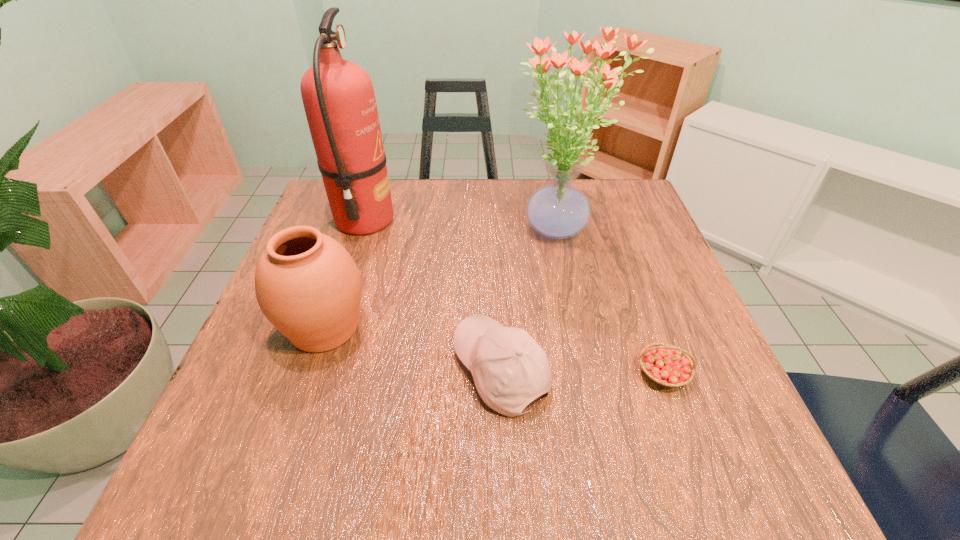
Where is `fire extinguisher`? fire extinguisher is located at coordinates (339, 101).

Locate an element on the screen. This screenshot has width=960, height=540. flower arrangement is located at coordinates (558, 210).

Where is `urn`? The width and height of the screenshot is (960, 540). urn is located at coordinates (307, 285).

The image size is (960, 540). What are the coordinates of `baseball cap` in the screenshot? It's located at (509, 368).

At what (x,y) coordinates should I click in order to perform the action: click on strawberry. Please return your answer as a coordinate pair (x, y). Looking at the image, I should click on (666, 365).

You are a GUI agent. You are given a task and a screenshot of the screen. Output one action in this format:
    pyautogui.click(x=<x>, y=<y>)
    Task: Click on the vacant space located 0.090m on the side of the fire extinguisher with the nozzle and handle
    The height and width of the screenshot is (540, 960).
    Given the screenshot: What is the action you would take?
    pyautogui.click(x=430, y=220)

The width and height of the screenshot is (960, 540). In order to click on vacant space located 0.370m on the left of the flower arrangement in this screenshot , I will do `click(354, 232)`.

In order to click on vacant space situated on the front of the third shortest object in this screenshot , I will do `click(285, 445)`.

Where is `vacant area situated on the front-facing side of the fourth tallest object`? The image size is (960, 540). vacant area situated on the front-facing side of the fourth tallest object is located at coordinates (357, 370).

Identify the location of free location located 0.340m on the front-facing side of the fourth tallest object. (260, 370).